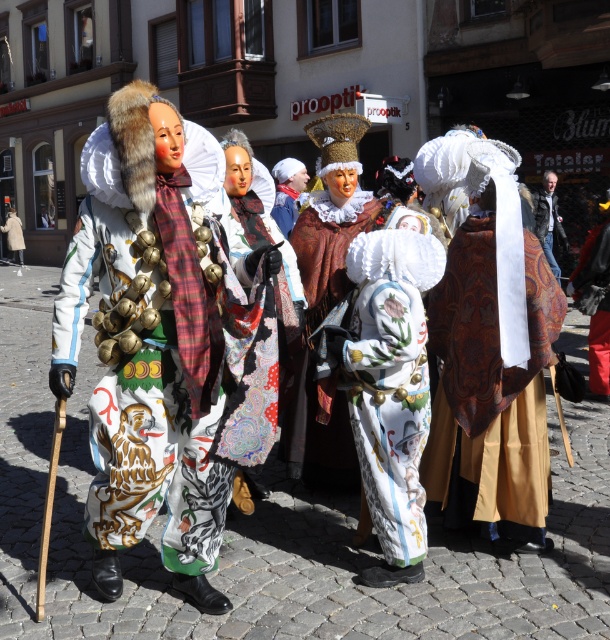
Based on the photo, you are standing on the cobblestone street in front of the prooptik building. You see two points marked in the scene. Which point is closer to you, point (381, 449) or point (605, 387)?

Point (381, 449) is closer to you than point (605, 387).

You are a photographer trying to capture both the white painted fabric costume at center and the red velvet coat at center in a single shot. Since you can only focus on one subject at a time, which costume should you focus on to ensure the other remains in the background?

You should focus on the white painted fabric costume at center because it is in front of the red velvet coat at center, so the red velvet coat at center will naturally be in the background if the white painted fabric costume at center is in focus.